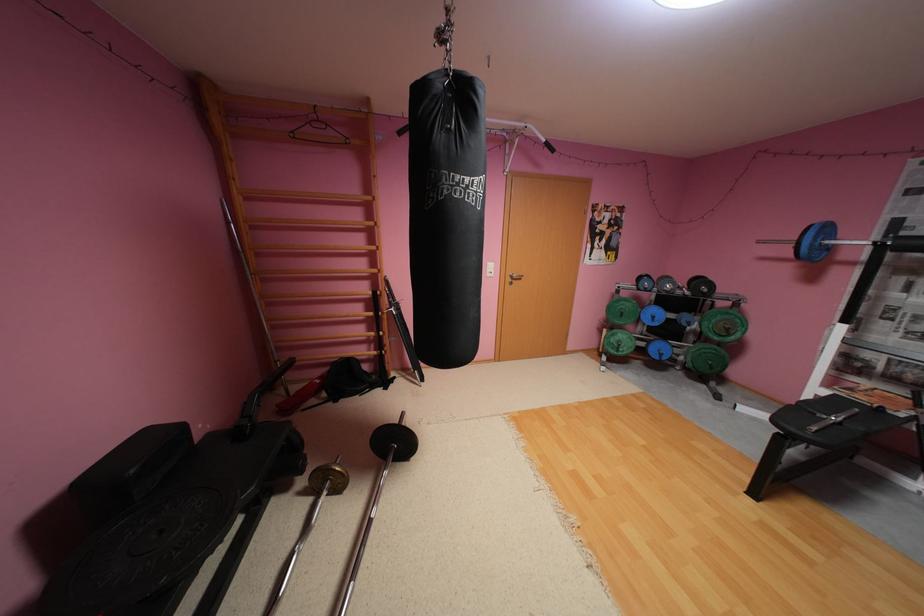
Locate an element on the screen. This screenshot has width=924, height=616. blue weight plate is located at coordinates pyautogui.click(x=164, y=525).